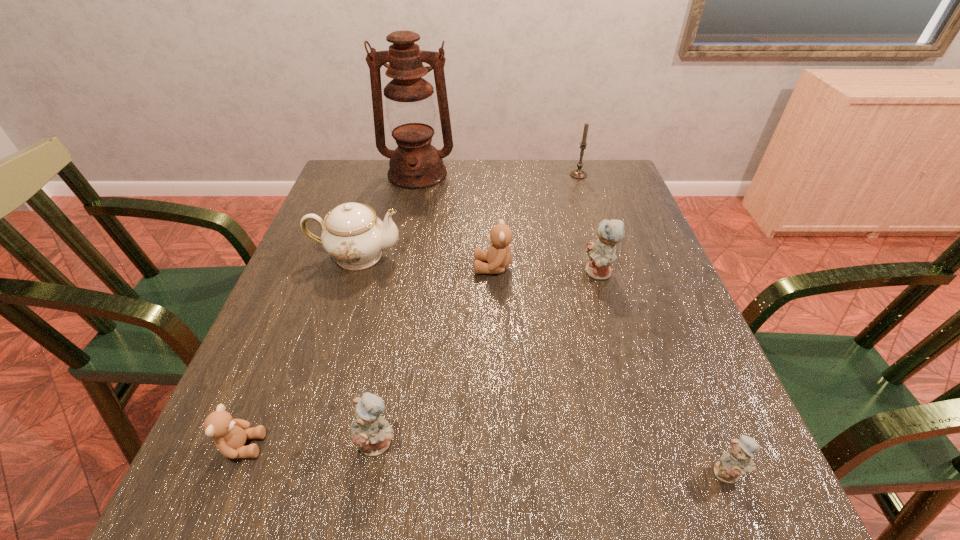
The width and height of the screenshot is (960, 540). Find the location of `vacant space situated 0.100m on the face of the fifth object from left to right`. vacant space situated 0.100m on the face of the fifth object from left to right is located at coordinates (432, 267).

You are a GUI agent. You are given a task and a screenshot of the screen. Output one action in this format:
    pyautogui.click(x=<x>, y=<y>)
    Task: Click on the free location located 0.070m on the face of the fifth object from left to right
    
    Given the screenshot: What is the action you would take?
    pyautogui.click(x=444, y=267)

Locate an element on the screen. vacant space located 0.100m on the front-facing side of the second smallest blue teddy bear is located at coordinates (363, 528).

Identify the location of vacant space located 0.260m on the face of the left brown teddy bear. The height and width of the screenshot is (540, 960). (422, 446).

The height and width of the screenshot is (540, 960). What are the coordinates of `oil lamp located in the far edge section of the desktop` in the screenshot? It's located at (415, 164).

The width and height of the screenshot is (960, 540). In order to click on candle at the far edge in this screenshot , I will do `click(578, 173)`.

The image size is (960, 540). In order to click on object located in the near edge section of the desktop in this screenshot , I will do `click(737, 461)`.

Identify the location of oil lamp at the left edge. 415,164.

The width and height of the screenshot is (960, 540). What are the coordinates of `chinaware that is positioned at the left edge` in the screenshot? It's located at 352,234.

Locate an element on the screen. The height and width of the screenshot is (540, 960). teddy bear present at the left edge is located at coordinates (229, 434).